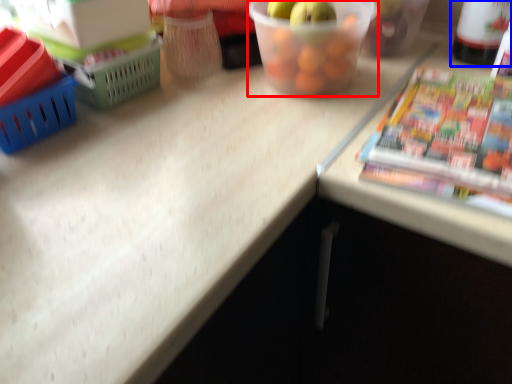
Question: Which point is further to the camera, glass bowl (highlighted by a red box) or bottle (highlighted by a blue box)?

Choices:
 (A) glass bowl
 (B) bottle

Answer: (B)